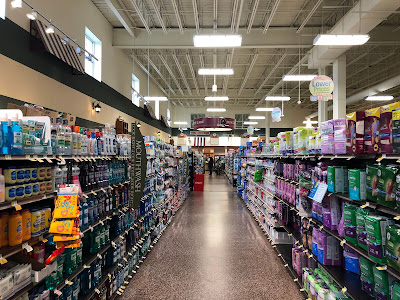
This screenshot has width=400, height=300. Find the location of `light`. light is located at coordinates (228, 39).